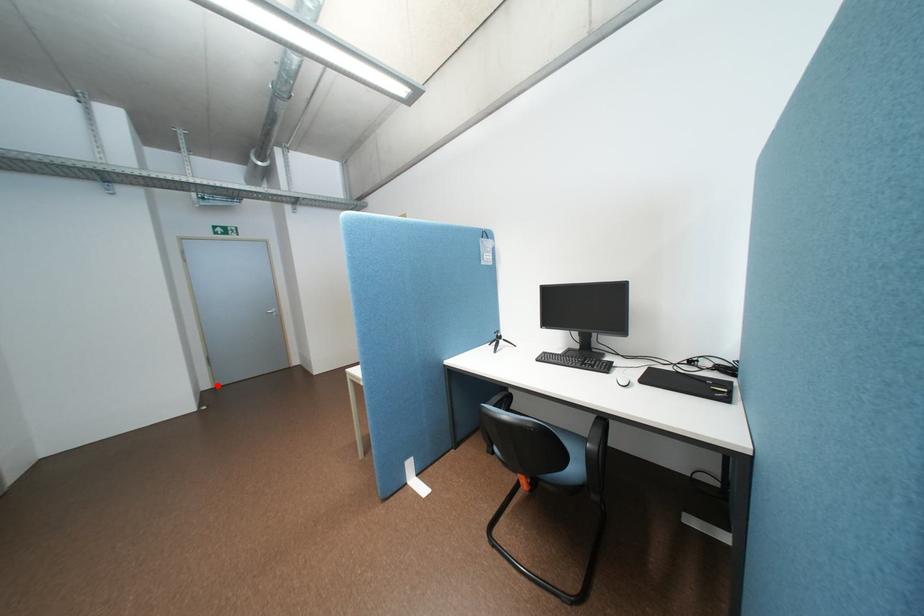
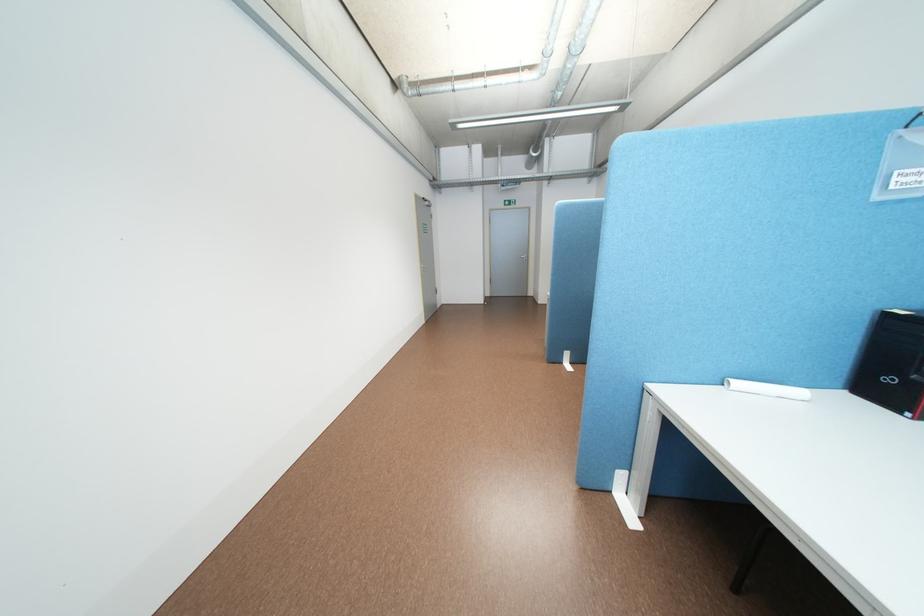
Question: I am providing you with two images of the same scene from different viewpoints. Given a red point in image1, look at the same physical point in image2. Is it:

Choices:
 (A) Closer to the viewpoint
 (B) Farther from the viewpoint

Answer: (B)